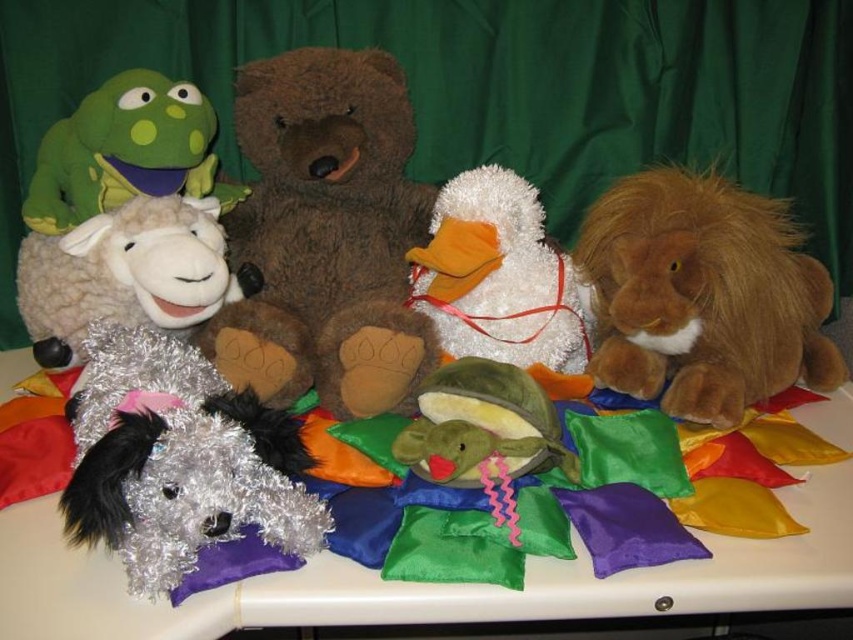
Question: Among these points, which one is farthest from the camera?

Choices:
 (A) (38, 596)
 (B) (749, 400)

Answer: (B)

Question: Observing the image, what is the correct spatial positioning of brown plush bear at center in reference to fuzzy silver dog at lower left?

Choices:
 (A) right
 (B) left

Answer: (A)

Question: Considering the relative positions of brown plush bear at center and green plush frog at upper left in the image provided, where is brown plush bear at center located with respect to green plush frog at upper left?

Choices:
 (A) left
 (B) right

Answer: (B)

Question: Considering the real-world distances, which object is closest to the fuzzy silver dog at lower left?

Choices:
 (A) white fluffy duck at center
 (B) green plush frog at upper left

Answer: (B)

Question: Which point is closer to the camera?

Choices:
 (A) (79, 164)
 (B) (370, 234)
 (C) (657, 612)
 (D) (136, 520)

Answer: (D)

Question: Can you confirm if brown plush bear at center is positioned to the left of silky white table at center?

Choices:
 (A) yes
 (B) no

Answer: (A)